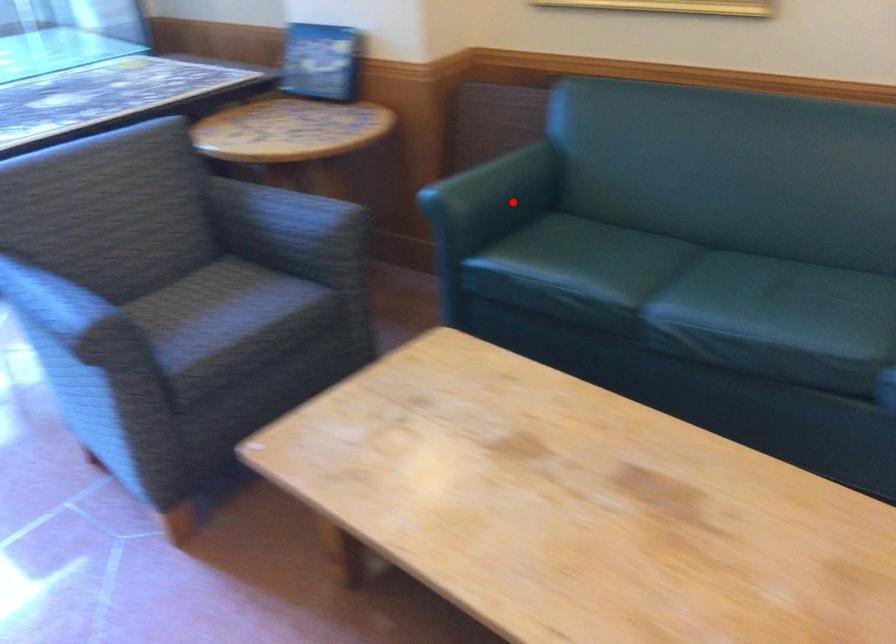
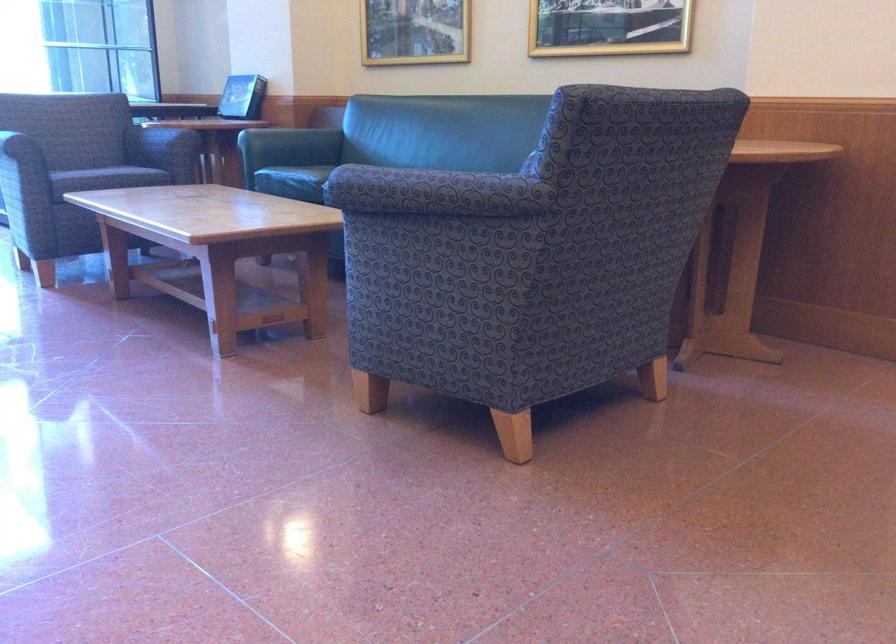
The point at the highlighted location is marked in the first image. Where is the corresponding point in the second image?

(290, 145)